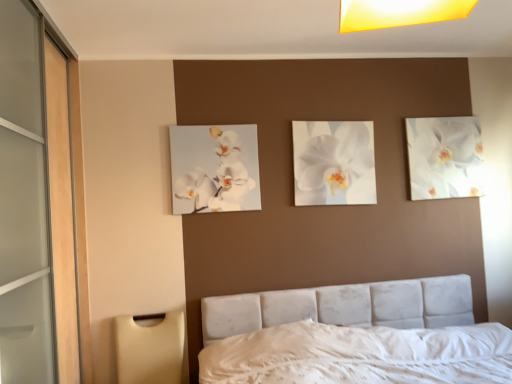
Question: Is white glossy orchid at upper right, which ranks as the third flower in front-to-back order, thinner than velvet white bed at center?

Choices:
 (A) yes
 (B) no

Answer: (A)

Question: Is white glossy orchid at upper right, the third flower when ordered from left to right, outside of velvet white bed at center?

Choices:
 (A) no
 (B) yes

Answer: (B)

Question: From a real-world perspective, is white glossy orchid at upper right, which ranks as the third flower in front-to-back order, beneath velvet white bed at center?

Choices:
 (A) yes
 (B) no

Answer: (B)

Question: From the image's perspective, is white glossy orchid at upper right, which ranks as the third flower in front-to-back order, beneath velvet white bed at center?

Choices:
 (A) no
 (B) yes

Answer: (A)

Question: Is white glossy orchid at upper right, the third flower when ordered from left to right, bigger than velvet white bed at center?

Choices:
 (A) yes
 (B) no

Answer: (B)

Question: Considering the positions of white glossy orchid at upper right, which ranks as the third flower in front-to-back order, and white glossy orchid at center, acting as the second flower starting from the back, in the image, is white glossy orchid at upper right, which ranks as the third flower in front-to-back order, wider or thinner than white glossy orchid at center, acting as the second flower starting from the back,?

Choices:
 (A) wide
 (B) thin

Answer: (A)

Question: In the image, is white glossy orchid at upper right, which ranks as the third flower in front-to-back order, on the left side or the right side of white glossy orchid at center, placed as the 2th flower when sorted from right to left?

Choices:
 (A) left
 (B) right

Answer: (B)

Question: From the image's perspective, relative to white glossy orchid at center, which is the second flower from front to back, is white glossy orchid at upper right, the third flower when ordered from left to right, above or below?

Choices:
 (A) above
 (B) below

Answer: (A)

Question: From a real-world perspective, is white glossy orchid at upper right, which ranks as the third flower in front-to-back order, physically located above or below white glossy orchid at center, placed as the 2th flower when sorted from right to left?

Choices:
 (A) below
 (B) above

Answer: (B)

Question: From a real-world perspective, is white glossy orchid at center, which is the second flower from front to back, above or below velvet white bed at center?

Choices:
 (A) above
 (B) below

Answer: (A)

Question: In terms of width, does white glossy orchid at center, placed as the 2th flower when sorted from right to left, look wider or thinner when compared to velvet white bed at center?

Choices:
 (A) wide
 (B) thin

Answer: (B)

Question: Choose the correct answer: Is white glossy orchid at center, acting as the second flower starting from the back, inside velvet white bed at center or outside it?

Choices:
 (A) outside
 (B) inside

Answer: (A)

Question: Is point (326, 155) positioned closer to the camera than point (306, 354)?

Choices:
 (A) farther
 (B) closer

Answer: (A)

Question: Considering the positions of point (190, 211) and point (296, 144), is point (190, 211) closer or farther from the camera than point (296, 144)?

Choices:
 (A) farther
 (B) closer

Answer: (B)

Question: From the image's perspective, relative to white glossy orchid at center, placed as the 2th flower when sorted from right to left, is white glossy orchid at upper left, which appears as the first flower when viewed from the front, above or below?

Choices:
 (A) above
 (B) below

Answer: (B)